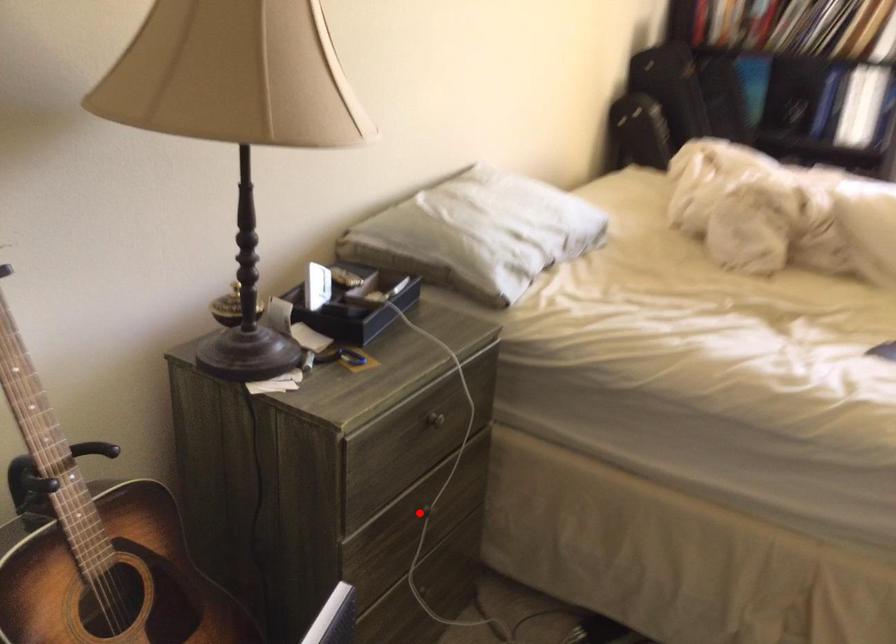
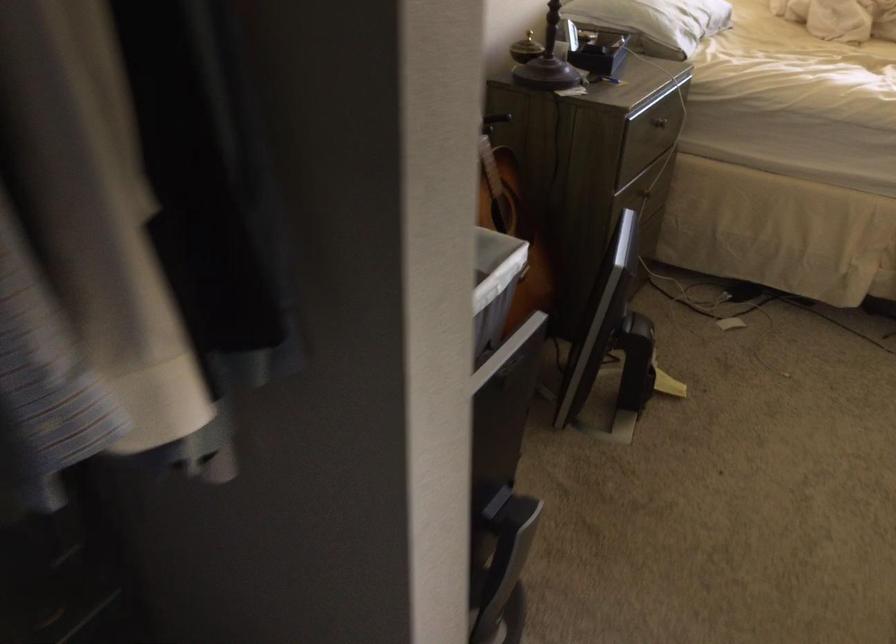
The point at the highlighted location is marked in the first image. Where is the corresponding point in the second image?

(645, 194)